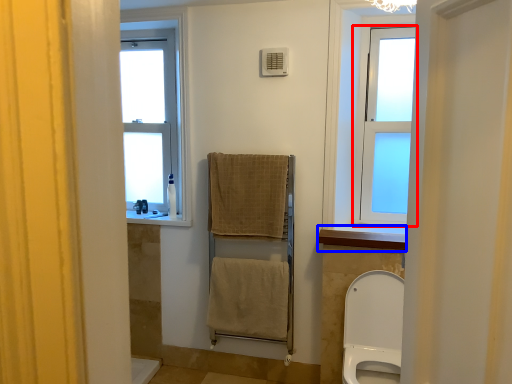
Question: Among these objects, which one is farthest to the camera, window (highlighted by a red box) or window sill (highlighted by a blue box)?

Choices:
 (A) window
 (B) window sill

Answer: (A)